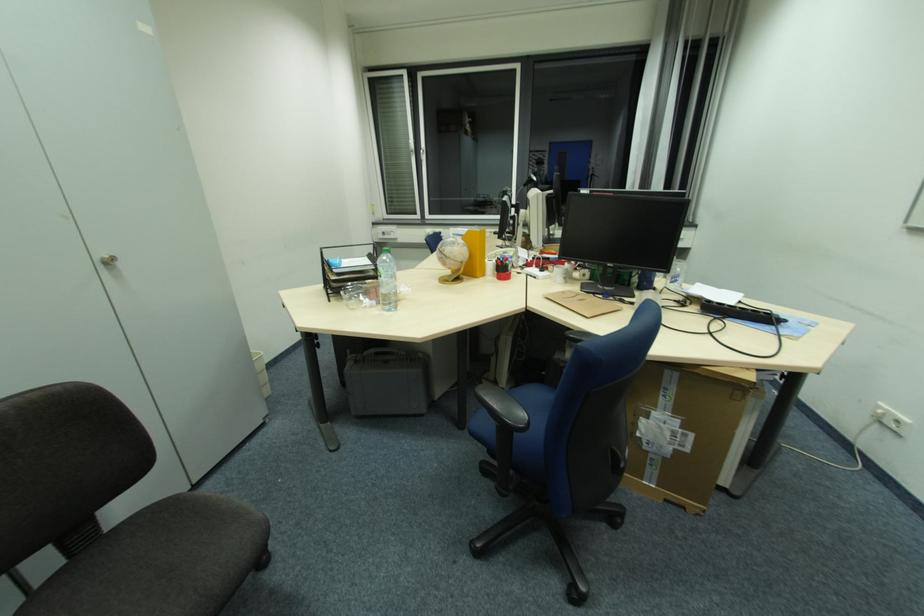
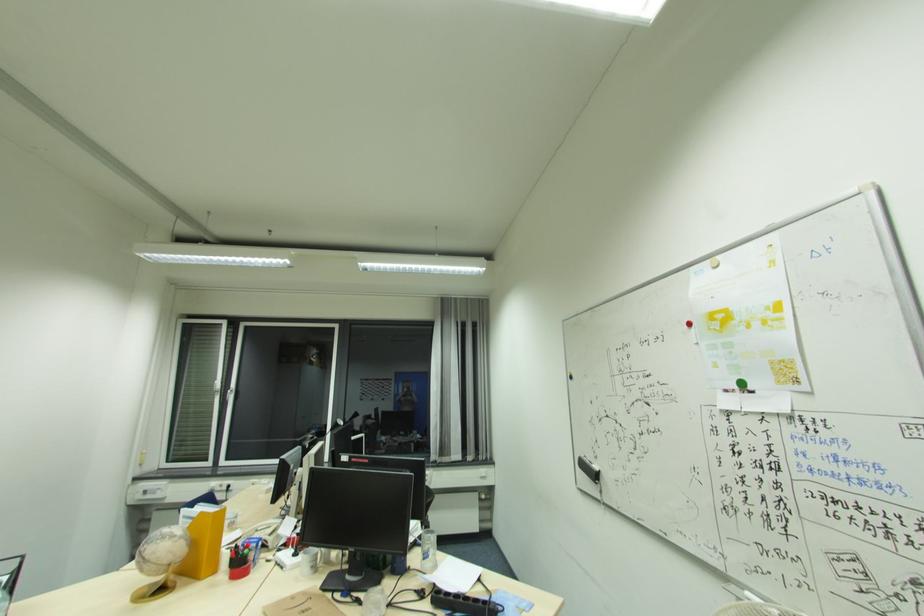
Where in the second image is the point corresponding to point (675, 284) from the first image?

(428, 560)